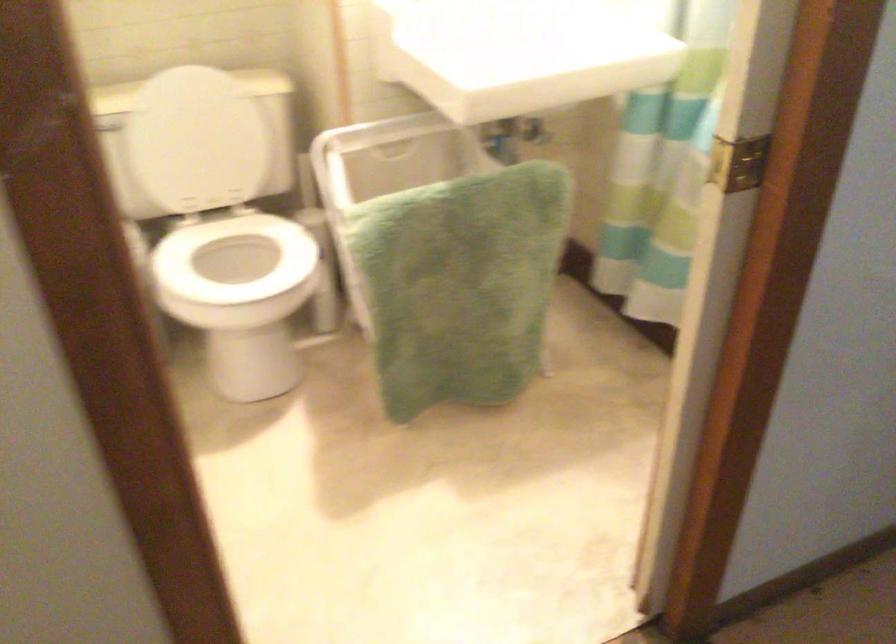
Identify the location of white toilet seat. This screenshot has height=644, width=896. (234, 259).